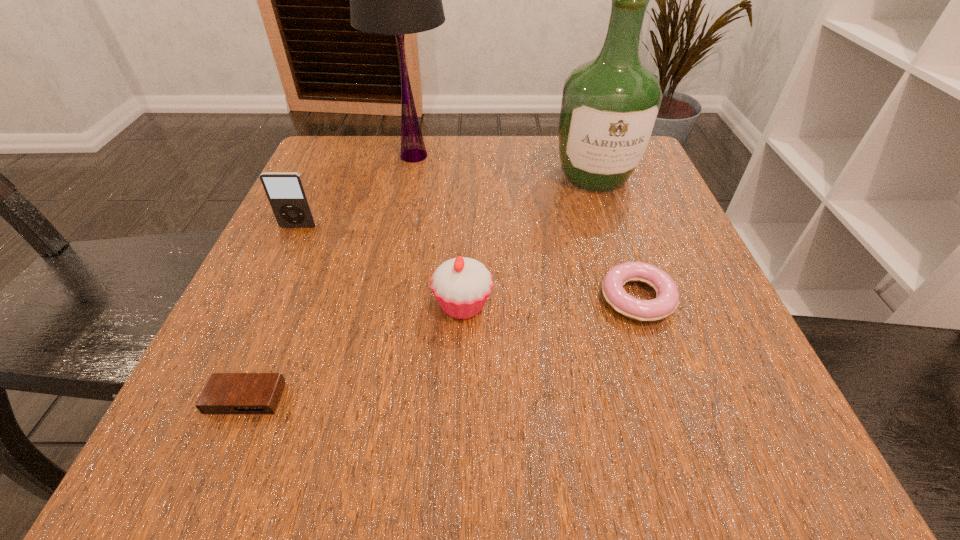
Locate an element on the screen. This screenshot has height=540, width=960. vacant space at the near left corner of the desktop is located at coordinates (293, 464).

The width and height of the screenshot is (960, 540). In the image, there is a desktop. Find the location of `vacant space at the far right corner`. vacant space at the far right corner is located at coordinates (653, 180).

Identify the location of vacant area at the near right corner of the desktop. (788, 454).

Find the location of a particular element. unoccupied area between the alarm clock and the fourth nearest object is located at coordinates (272, 312).

Locate an element on the screen. The image size is (960, 540). unoccupied position between the fourth tallest object and the liquor is located at coordinates (529, 241).

Where is `free area in between the liquor and the shortest object`? This screenshot has height=540, width=960. free area in between the liquor and the shortest object is located at coordinates (420, 287).

Find the location of `vacant area between the third tallest object and the liquor`. vacant area between the third tallest object and the liquor is located at coordinates (446, 202).

Find the location of `free space between the lampshade and the nearest object`. free space between the lampshade and the nearest object is located at coordinates (330, 277).

Image resolution: width=960 pixels, height=540 pixels. Identify the location of free space between the iPod and the lampshade. (356, 191).

At what (x,y) coordinates should I click in order to perform the action: click on empty space that is in between the third shortest object and the doughnut. Please return your answer as a coordinate pair (x, y). Image resolution: width=960 pixels, height=540 pixels. Looking at the image, I should click on (550, 301).